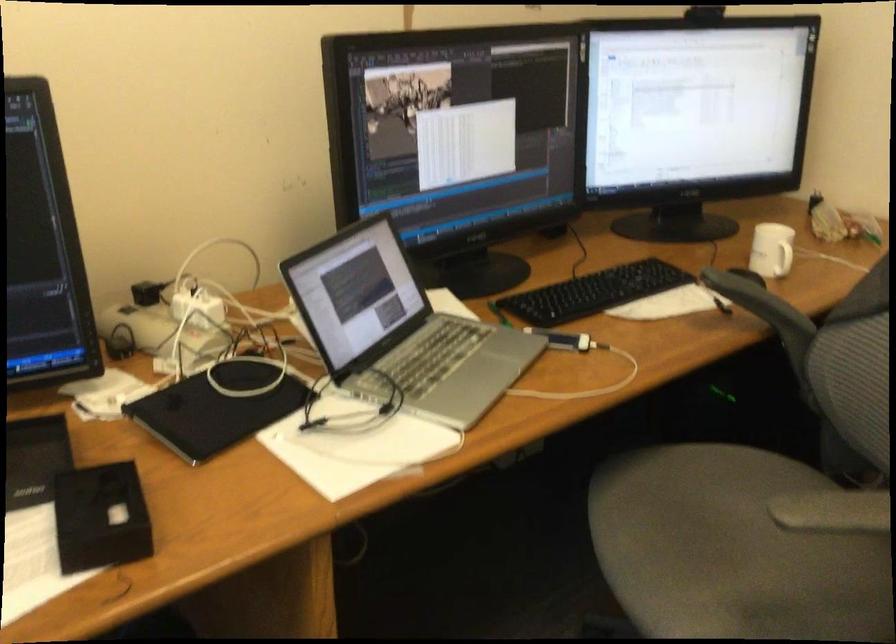
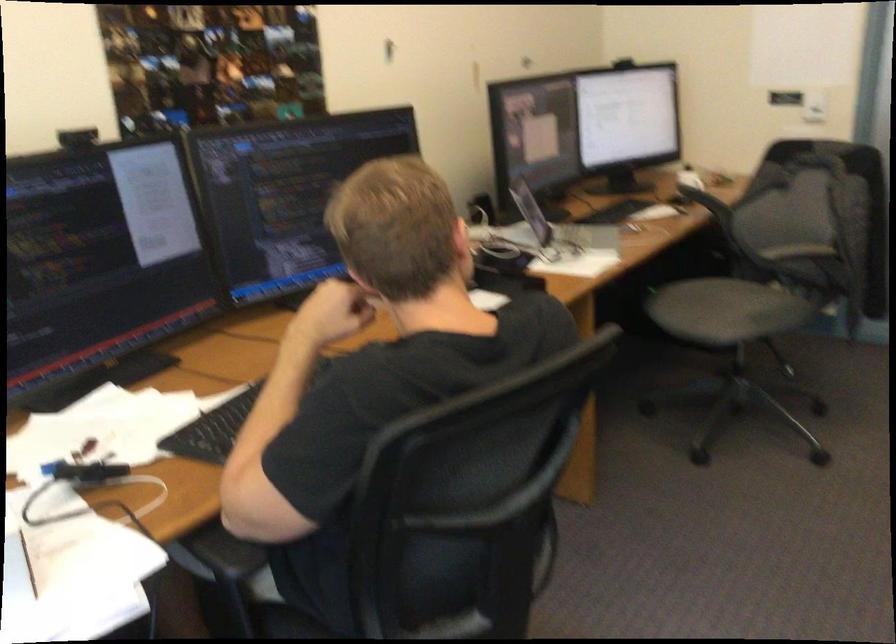
Locate, in the second image, the point that corresponds to (676,564) in the first image.

(709, 308)